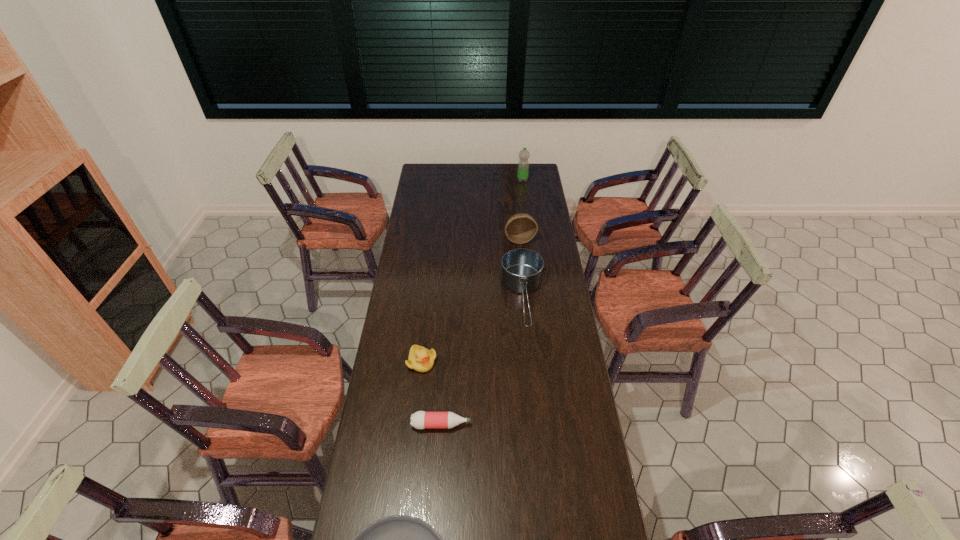
Locate an element on the screen. The image size is (960, 540). vacant region located on the front of the farthest object is located at coordinates (525, 202).

Where is `vacant position located 0.070m on the left of the second tallest object`? vacant position located 0.070m on the left of the second tallest object is located at coordinates (491, 239).

Find the location of a particular element. free space located with the handle extending from one side of the third tallest object is located at coordinates (530, 371).

The height and width of the screenshot is (540, 960). In order to click on vacant space located 0.140m on the beak of the duckling in this screenshot , I will do `click(417, 407)`.

What are the coordinates of `blank area located with the cap open on the second shortest object` in the screenshot? It's located at (549, 424).

At what (x,y) coordinates should I click in order to perform the action: click on object that is at the far edge. Please return your answer as a coordinate pair (x, y). The height and width of the screenshot is (540, 960). Looking at the image, I should click on (523, 166).

I want to click on duckling situated at the left edge, so click(x=421, y=359).

Where is `bottle positioned at the left edge`? bottle positioned at the left edge is located at coordinates (420, 420).

This screenshot has width=960, height=540. In order to click on water bottle that is at the right edge in this screenshot , I will do `click(523, 166)`.

I want to click on bowl that is at the right edge, so click(x=520, y=228).